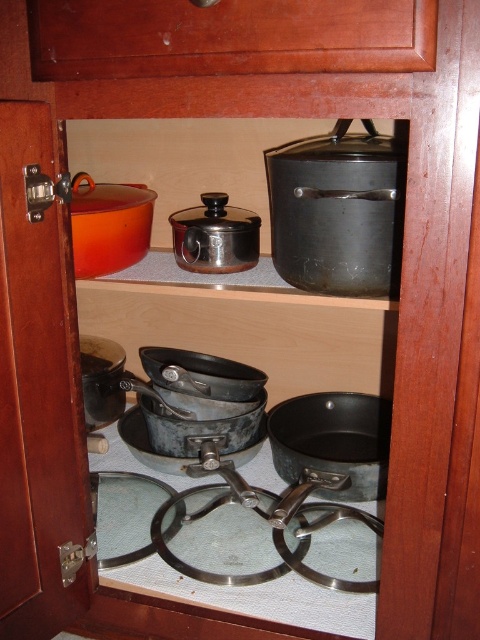
Can you confirm if wooden drawer at upper center is positioned to the left of satin silver pot at center?

Incorrect, wooden drawer at upper center is not on the left side of satin silver pot at center.

Between point (332, 35) and point (219, 204), which one is positioned behind?

The point (219, 204) is more distant.

Who is more forward, (116,45) or (191,269)?

Positioned in front is point (116,45).

Locate an element on the screen. This screenshot has width=480, height=640. wooden drawer at upper center is located at coordinates (228, 36).

Does wooden drawer at upper center have a larger size compared to matte black frying pan at left?

Yes, wooden drawer at upper center is bigger than matte black frying pan at left.

Who is more distant from viewer, (408,42) or (86,348)?

The point (86,348) is more distant.

This screenshot has height=640, width=480. Find the location of `wooden drawer at upper center`. wooden drawer at upper center is located at coordinates (x=228, y=36).

Is metallic glass cookware at center thinner than matte black frying pan at left?

No, metallic glass cookware at center is not thinner than matte black frying pan at left.

Describe the element at coordinates (232, 524) in the screenshot. Image resolution: width=480 pixels, height=640 pixels. I see `metallic glass cookware at center` at that location.

This screenshot has height=640, width=480. In order to click on metallic glass cookware at center in this screenshot , I will do `click(232, 524)`.